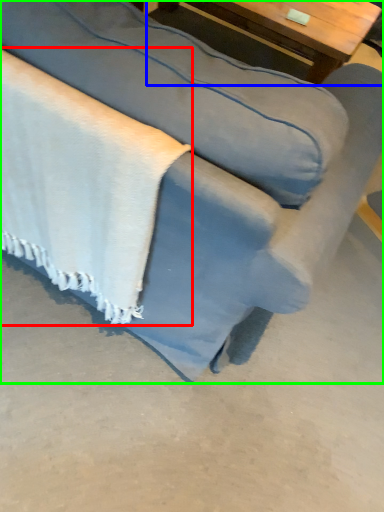
Question: Which is nearer to the blanket (highlighted by a red box)? table (highlighted by a blue box) or studio couch (highlighted by a green box).

Choices:
 (A) table
 (B) studio couch

Answer: (B)